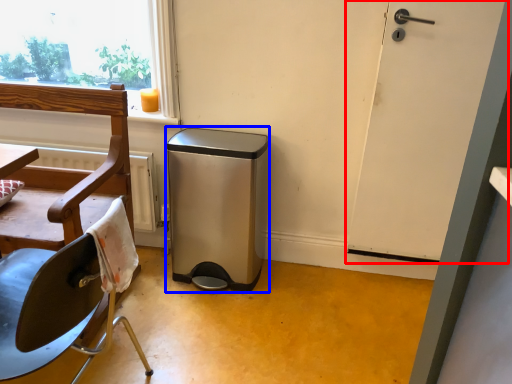
Question: Which of the following is the farthest to the observer, door (highlighted by a red box) or dish washer (highlighted by a blue box)?

Choices:
 (A) door
 (B) dish washer

Answer: (B)